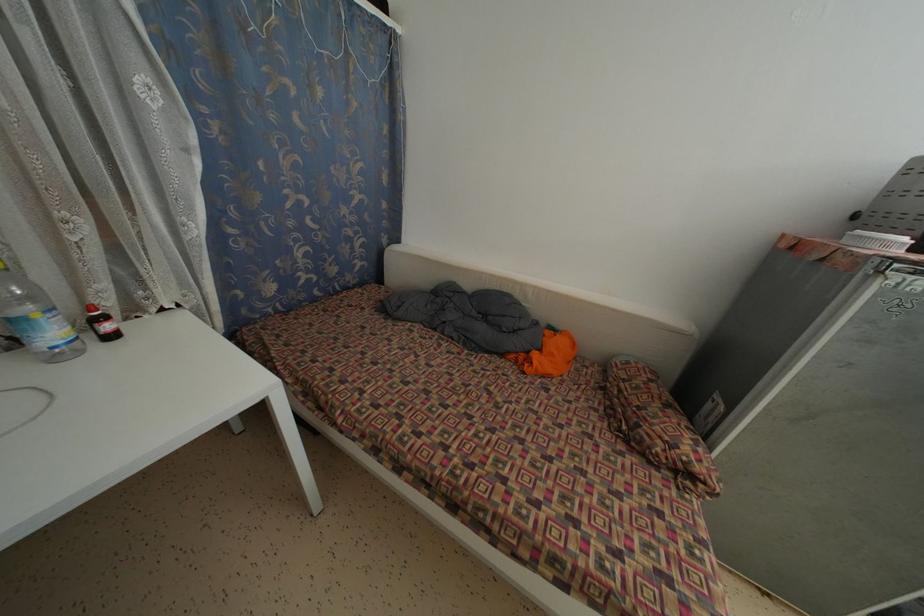
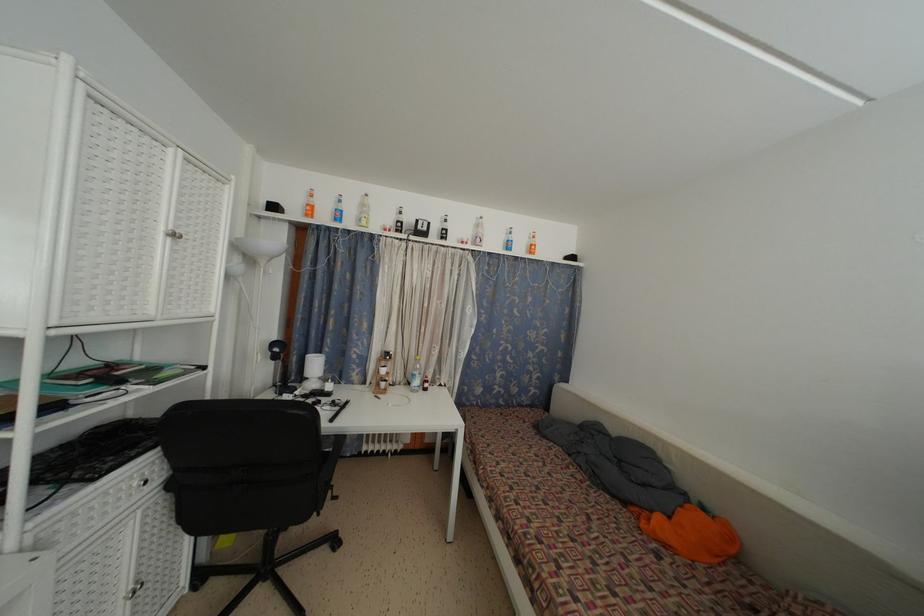
The point at [506,360] is marked in the first image. Where is the corresponding point in the second image?

(629, 509)